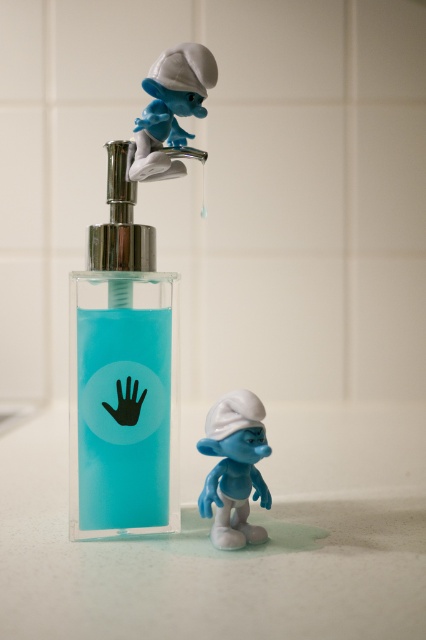
Question: Which point is closer to the camera?

Choices:
 (A) (138, 145)
 (B) (75, 452)
 (C) (207, 422)

Answer: (C)

Question: Is transparent plastic soap dispenser at center to the left of blue matte smurf at upper center from the viewer's perspective?

Choices:
 (A) yes
 (B) no

Answer: (A)

Question: Which of these objects is positioned farthest from the transparent plastic soap dispenser at center?

Choices:
 (A) blue matte smurf at upper center
 (B) blue matte smurf at lower center

Answer: (A)

Question: Can you confirm if blue matte smurf at lower center is positioned to the right of blue matte smurf at upper center?

Choices:
 (A) no
 (B) yes

Answer: (B)

Question: Considering the real-world distances, which object is closest to the blue matte smurf at lower center?

Choices:
 (A) transparent plastic soap dispenser at center
 (B) blue matte smurf at upper center

Answer: (A)

Question: Does transparent plastic soap dispenser at center have a smaller size compared to blue matte smurf at upper center?

Choices:
 (A) yes
 (B) no

Answer: (B)